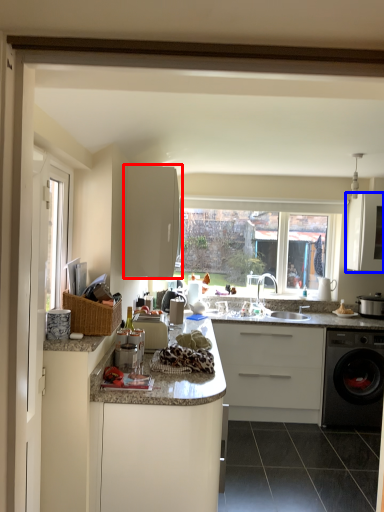
Question: Which object appears closest to the camera in this image, cabinetry (highlighted by a red box) or cabinetry (highlighted by a blue box)?

Choices:
 (A) cabinetry
 (B) cabinetry

Answer: (A)